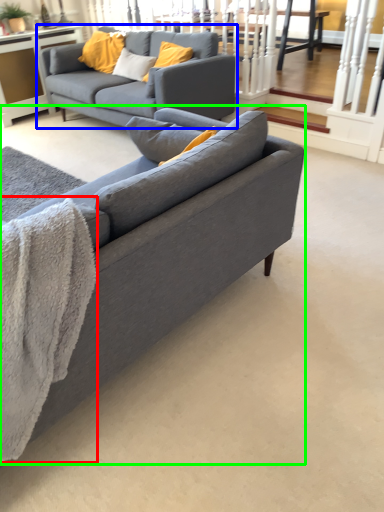
Question: Which object is positioned closest to blanket (highlighted by a red box)? Select from studio couch (highlighted by a blue box) and studio couch (highlighted by a green box).

Choices:
 (A) studio couch
 (B) studio couch

Answer: (B)